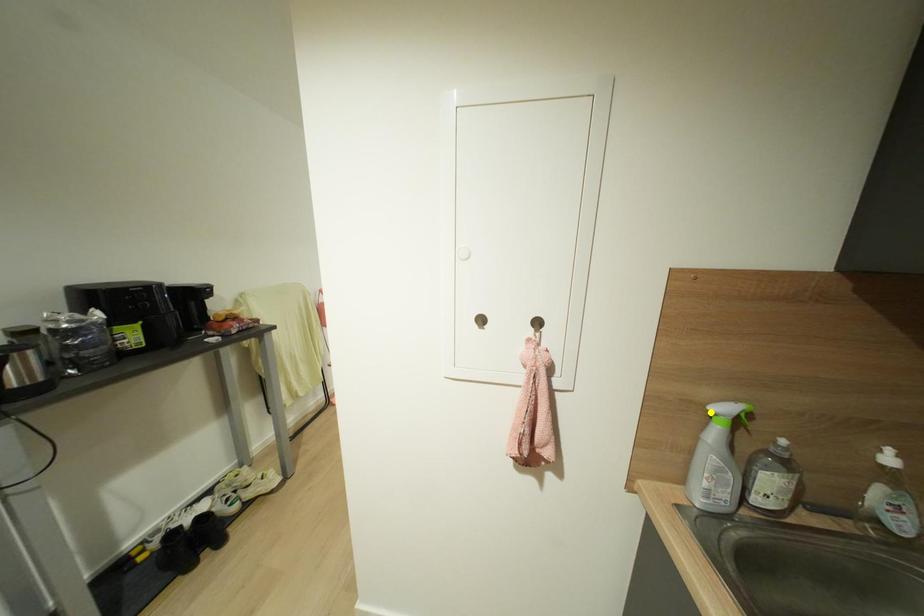
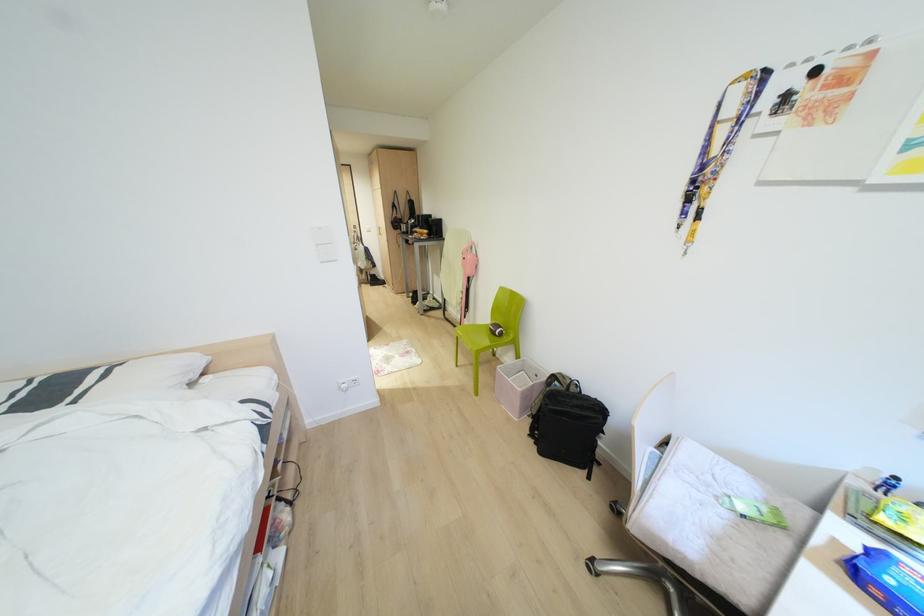
I am providing you with two images of the same scene from different viewpoints. Three points are marked in image1. Which point corresponds to a part or object that is occluded in image2?In image1, three points are marked. Which of them correspond to a part or object that is occluded in image2?Among the three points shown in image1, which one corresponds to a part or object that is no longer visible due to occlusion in image2?

green point, blue point, yellow point cannot be seen in image2.